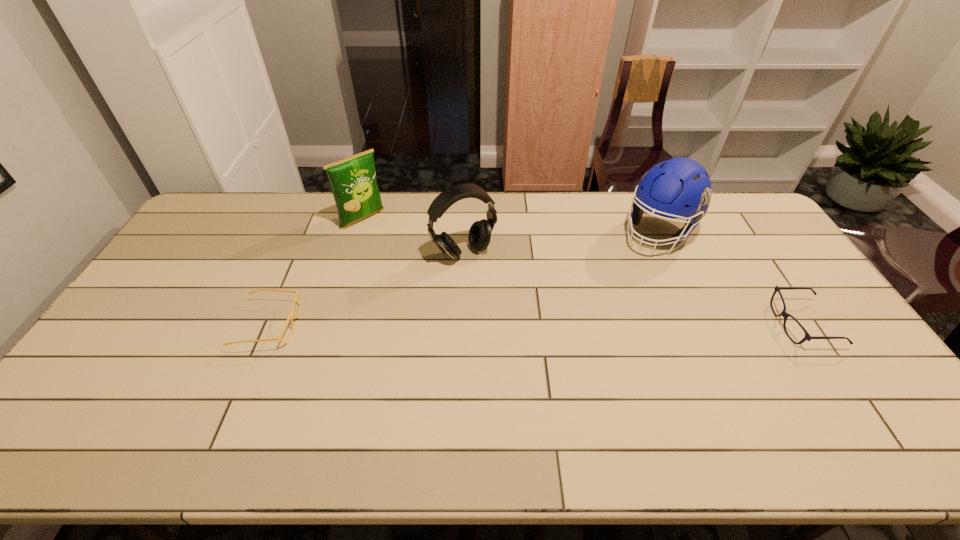
This screenshot has width=960, height=540. Identify the location of free spot between the third object from left to right and the second object from right to left. (562, 243).

I want to click on free area in between the left spectacles and the crisp (potato chip), so click(x=316, y=272).

The image size is (960, 540). Find the location of `unoccupied area between the leftmost object and the third object from left to right`. unoccupied area between the leftmost object and the third object from left to right is located at coordinates (367, 289).

In order to click on free space between the second object from right to left and the crisp (potato chip) in this screenshot , I will do `click(511, 226)`.

You are a GUI agent. You are given a task and a screenshot of the screen. Output one action in this format:
    pyautogui.click(x=<x>, y=<y>)
    Task: Click on the free space between the football helmet and the rightmost object
    This screenshot has width=960, height=540.
    Given the screenshot: What is the action you would take?
    pyautogui.click(x=731, y=279)

In order to click on vacant point located between the right spectacles and the left spectacles in this screenshot , I will do `click(536, 325)`.

This screenshot has height=540, width=960. Find the location of `vacant area that lies between the earphone and the football helmet`. vacant area that lies between the earphone and the football helmet is located at coordinates (562, 243).

Identify the location of object that is the third nearest to the second object from right to left. The image size is (960, 540). (353, 181).

The height and width of the screenshot is (540, 960). I want to click on the closest object to the fourth object from right to left, so click(479, 236).

Find the location of `free spot that satisfies the following two spatial constraints: 1. on the front side of the third object from right to left; 2. on the front-facing side of the right spectacles`. free spot that satisfies the following two spatial constraints: 1. on the front side of the third object from right to left; 2. on the front-facing side of the right spectacles is located at coordinates (461, 324).